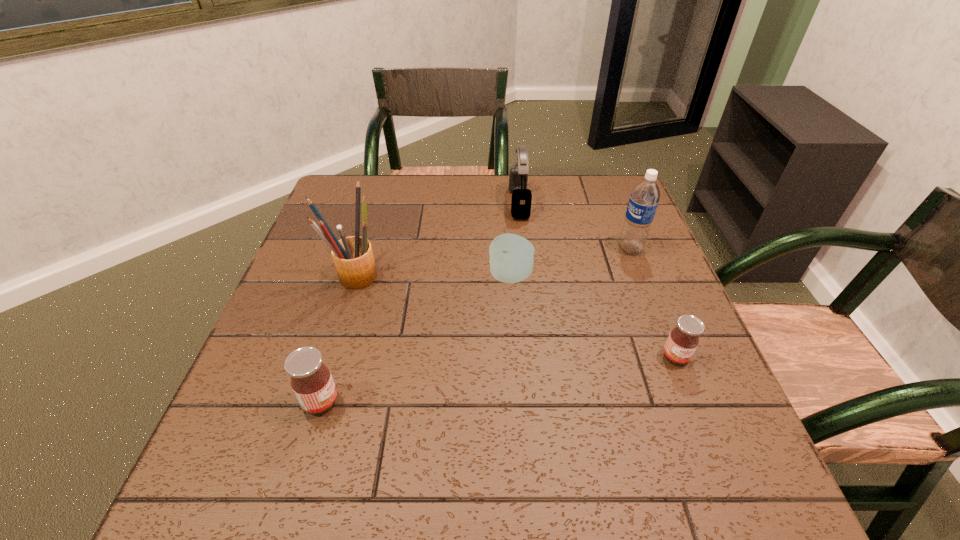
The image size is (960, 540). Identify the location of vacant area at the far right corner of the desktop. (622, 217).

Where is `unoccupied position between the farthest object and the pencil box`? This screenshot has height=540, width=960. unoccupied position between the farthest object and the pencil box is located at coordinates (438, 238).

Locate an element on the screen. Image resolution: width=960 pixels, height=540 pixels. free space between the pencil box and the left jam is located at coordinates (339, 338).

The width and height of the screenshot is (960, 540). Find the location of `free space between the nearer jam and the pencil box`. free space between the nearer jam and the pencil box is located at coordinates (339, 338).

Locate an element on the screen. vacant space that's between the left jam and the water bottle is located at coordinates (475, 325).

The image size is (960, 540). Identify the location of vacant space in between the fifth farthest object and the left jam. (498, 379).

Where is `vacant point located between the apple and the pencil box`? vacant point located between the apple and the pencil box is located at coordinates (433, 275).

The width and height of the screenshot is (960, 540). I want to click on vacant space that is in between the farther jam and the taller jam, so click(498, 379).

Identify the location of blank region between the nearest object and the fifth farthest object. This screenshot has height=540, width=960. (498, 379).

At what (x,y) coordinates should I click in order to perform the action: click on free space between the headset and the nearer jam. Please return your answer as a coordinate pair (x, y). Looking at the image, I should click on tap(420, 302).